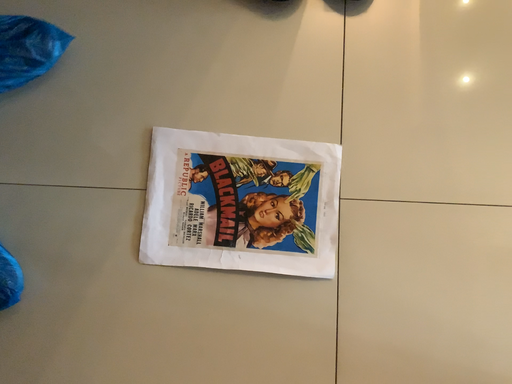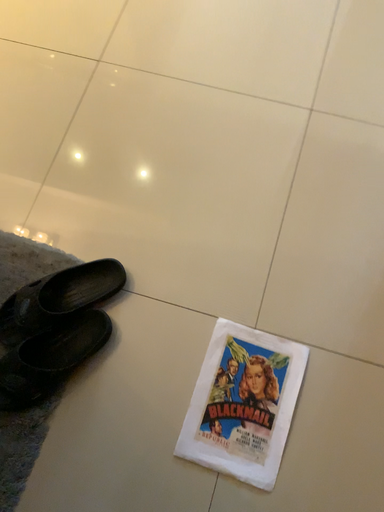
Question: How did the camera likely rotate when shooting the video?

Choices:
 (A) rotated upward
 (B) rotated downward

Answer: (A)